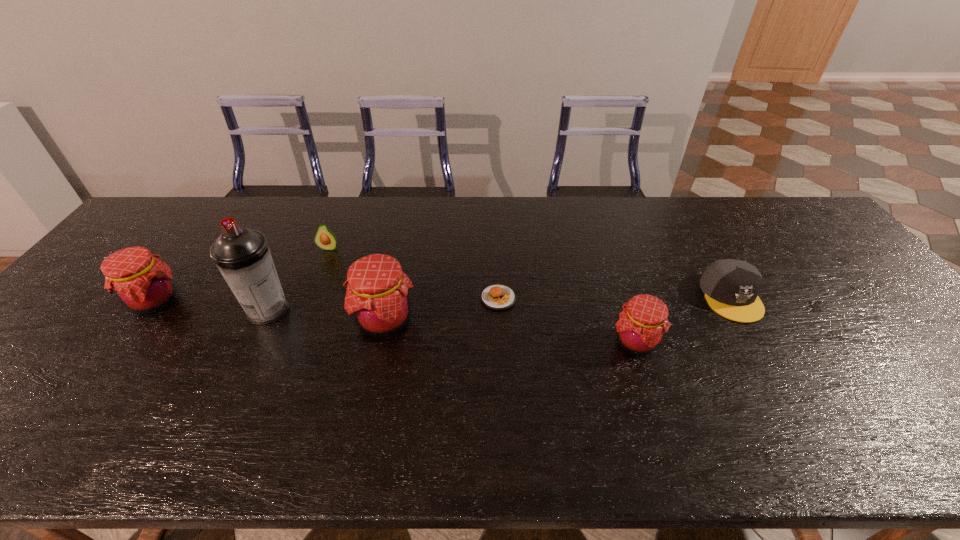
Find the location of a particular element. the leftmost jam is located at coordinates (143, 284).

At what (x,y) coordinates should I click in order to perform the action: click on the leftmost object. Please return your answer as a coordinate pair (x, y). The image size is (960, 540). Looking at the image, I should click on (143, 284).

Where is `the second jam from left to right`? the second jam from left to right is located at coordinates (378, 296).

The height and width of the screenshot is (540, 960). I want to click on the rightmost jam, so click(x=643, y=321).

Where is `the fourth shortest object`? Image resolution: width=960 pixels, height=540 pixels. the fourth shortest object is located at coordinates (643, 321).

Locate an element on the screen. The height and width of the screenshot is (540, 960). the farthest object is located at coordinates (325, 239).

Find the location of a particular element. The image size is (960, 540). avocado is located at coordinates (325, 239).

Image resolution: width=960 pixels, height=540 pixels. Find the location of `food`. food is located at coordinates (498, 297).

Identify the location of the shortest object. tap(498, 297).

Image resolution: width=960 pixels, height=540 pixels. Find the location of `the rightmost object`. the rightmost object is located at coordinates (731, 287).